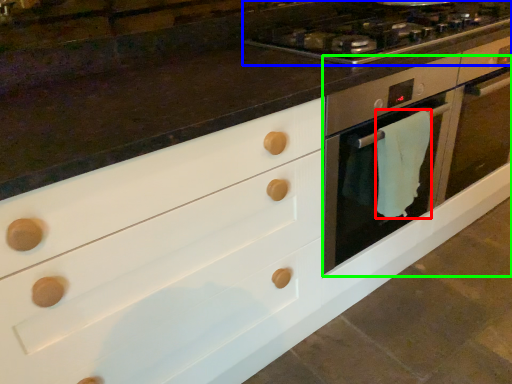
Question: Which object is positioned closest to material (highlighted by a red box)? Select from gas stove (highlighted by a blue box) and oven (highlighted by a green box).

Choices:
 (A) gas stove
 (B) oven

Answer: (B)